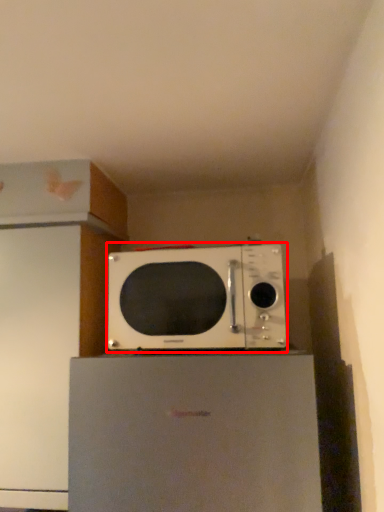
Question: From the image's perspective, what is the correct spatial positioning of microwave oven (annotated by the red box) in reference to appliance?

Choices:
 (A) below
 (B) above

Answer: (B)